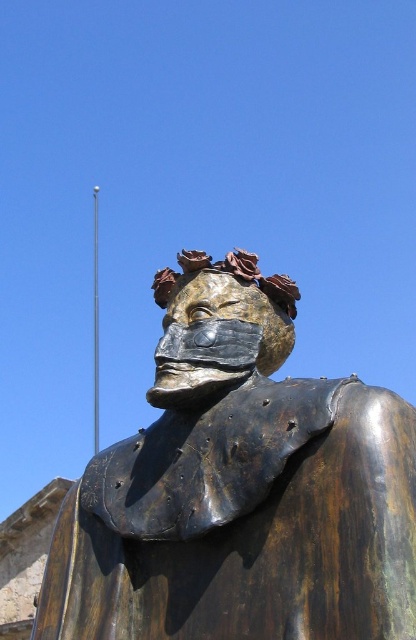
Does bronze statue at center come in front of bronze mask at center?

Yes, it is in front of bronze mask at center.

Is bronze statue at center positioned at the back of bronze mask at center?

That is False.

Which is in front, point (247, 493) or point (222, 316)?

Point (247, 493) is more forward.

Find the location of a particular element. The image size is (416, 640). bronze statue at center is located at coordinates (240, 488).